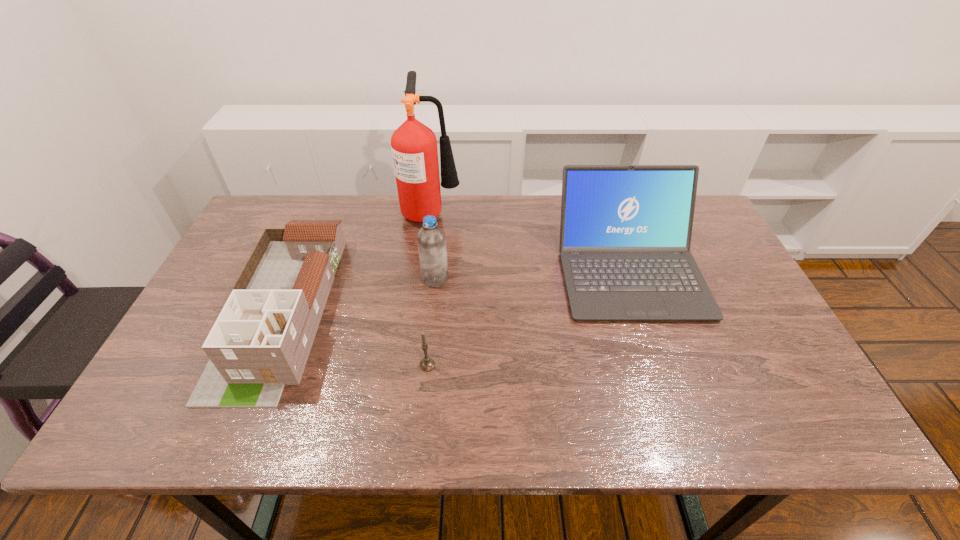
You are a GUI agent. You are given a task and a screenshot of the screen. Output one action in this format:
    pyautogui.click(x=<x>, y=<y>)
    Task: Click on the vacant area situated 0.210m on the right of the shortest object
    
    Given the screenshot: What is the action you would take?
    pyautogui.click(x=524, y=365)

Where is `fire extinguisher positioned at the far edge`? The height and width of the screenshot is (540, 960). fire extinguisher positioned at the far edge is located at coordinates (414, 149).

The width and height of the screenshot is (960, 540). Identify the location of laptop computer that is at the far edge. (625, 233).

Identify the location of object located in the near edge section of the desktop. This screenshot has height=540, width=960. coord(261,340).

Where is `object that is at the left edge`? Image resolution: width=960 pixels, height=540 pixels. object that is at the left edge is located at coordinates click(261, 340).

Where is `object that is at the right edge`? The height and width of the screenshot is (540, 960). object that is at the right edge is located at coordinates (625, 233).

Locate an element on the screen. Image resolution: width=960 pixels, height=540 pixels. object positioned at the near left corner is located at coordinates pyautogui.click(x=261, y=340).

Where is `object situated at the far right corner`? object situated at the far right corner is located at coordinates (625, 233).

In the image, there is a desktop. Identify the location of vacant space at the far edge. (549, 239).

In the image, there is a desktop. At what (x,y) coordinates should I click in order to perform the action: click on free space at the near edge. Please return your answer as a coordinate pair (x, y). The image size is (960, 540). Looking at the image, I should click on (549, 436).